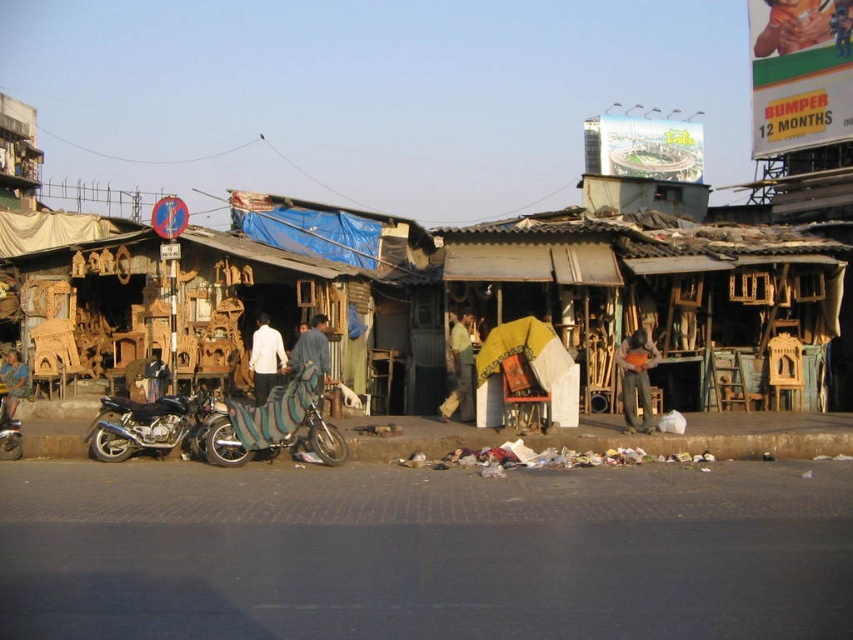
Between point (317, 451) and point (9, 416), which one is positioned in front?

Point (317, 451) is in front.

Between zebra-patterned fabric motorcycle at center and zebra-patterned leather motorcycle at lower left, which one has more height?

With more height is zebra-patterned fabric motorcycle at center.

Locate an element on the screen. The width and height of the screenshot is (853, 640). zebra-patterned fabric motorcycle at center is located at coordinates (273, 424).

Is zebra-patterned fabric motorcycle at center wider than white matte shirt at center?

Yes, zebra-patterned fabric motorcycle at center is wider than white matte shirt at center.

Is zebra-patterned fabric motorcycle at center thinner than white matte shirt at center?

No.

Is point (241, 412) closer to viewer compared to point (263, 371)?

Yes.

Locate an element on the screen. zebra-patterned fabric motorcycle at center is located at coordinates (273, 424).

Does shiny metallic motorcycle at center-left appear over white matte shirt at center?

No, shiny metallic motorcycle at center-left is not above white matte shirt at center.

Which is in front, point (178, 401) or point (264, 358)?

Point (178, 401)

Where is `shiny metallic motorcycle at center-left`? This screenshot has width=853, height=640. shiny metallic motorcycle at center-left is located at coordinates (149, 426).